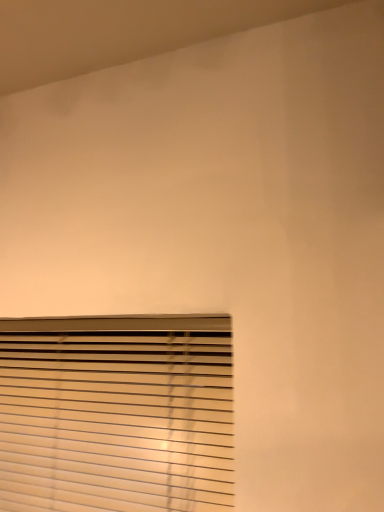
This screenshot has height=512, width=384. What do you see at coordinates (117, 413) in the screenshot?
I see `wooden blinds at bottom` at bounding box center [117, 413].

Identify the location of wooden blinds at bottom. (117, 413).

At what (x,y) coordinates should I click in order to perform the action: click on wooden blinds at bottom. Please return your answer as a coordinate pair (x, y). Looking at the image, I should click on (117, 413).